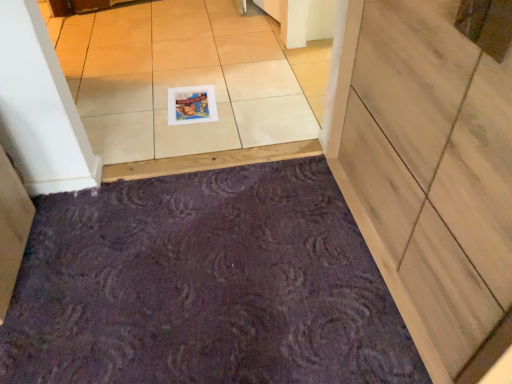
The image size is (512, 384). I want to click on vacant area that is situated to the right of matte plastic postcard at center, so click(243, 102).